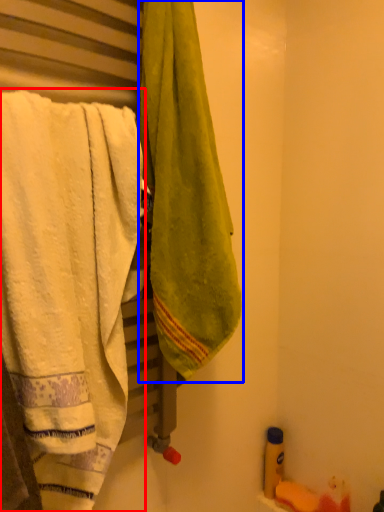
Question: Which of the following is the closest to the observer, towel (highlighted by a red box) or towel (highlighted by a blue box)?

Choices:
 (A) towel
 (B) towel

Answer: (A)